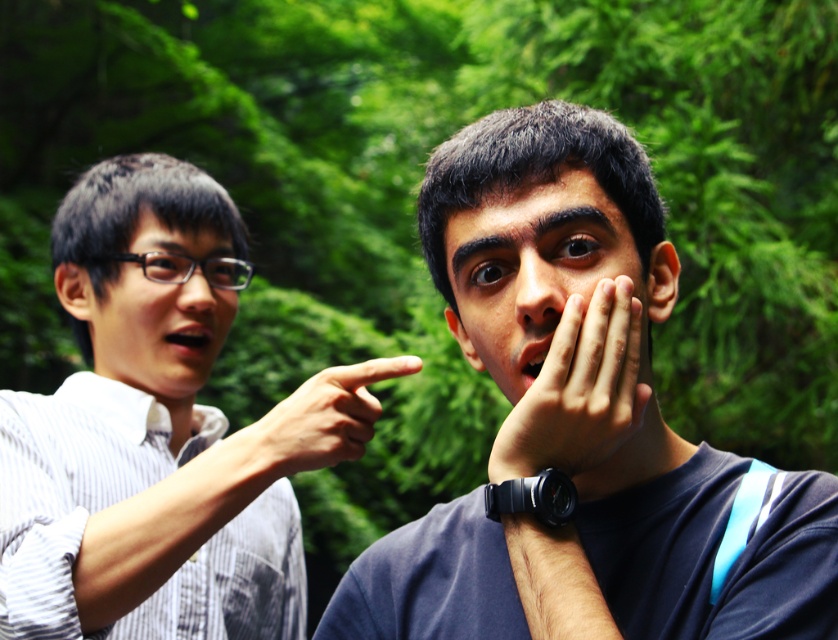
You are a photographer trying to capture a closeup of the matte black glasses at left and the matte skin finger at center in the image. Based on their sizes, which object should you focus on first if you want both to be in sharp focus?

The matte black glasses at left might be wider than the matte skin finger at center, so you should focus on the matte black glasses at left first to ensure both are in sharp focus.